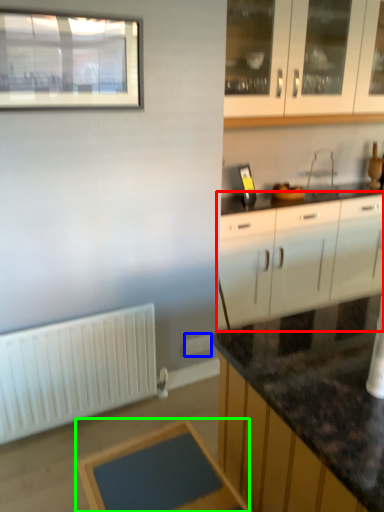
Question: Which object is the farthest from cabinetry (highlighted by a red box)? Choose among these: electric outlet (highlighted by a blue box) or table (highlighted by a green box).

Choices:
 (A) electric outlet
 (B) table

Answer: (B)